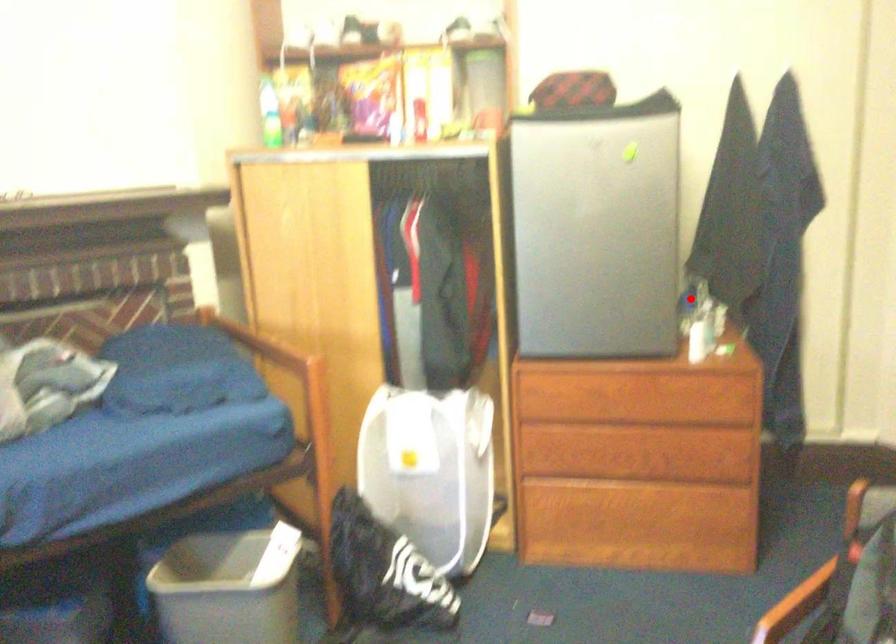
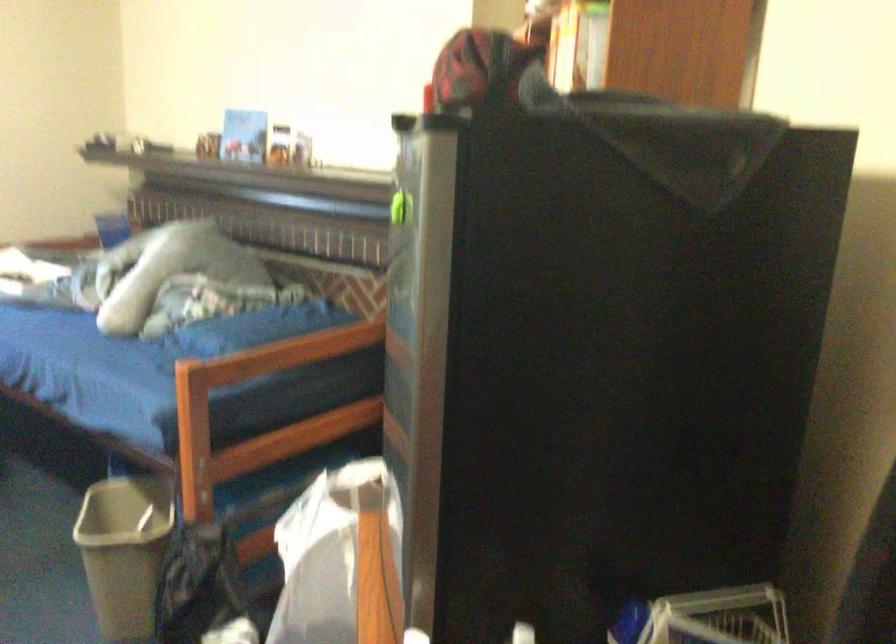
Question: A red point is marked in image1. In image2, is the corresponding 3D point closer to the camera or farther? Reply with the corresponding letter.

Choices:
 (A) The corresponding 3D point is closer.
 (B) The corresponding 3D point is farther.

Answer: (A)